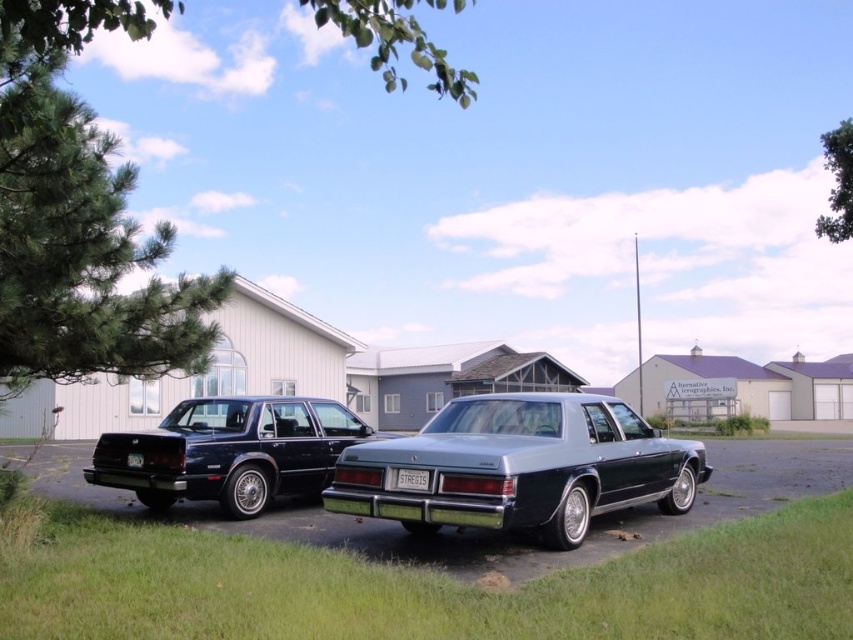
Question: Is metallic blue car at center to the left of glossy black sedan at left from the viewer's perspective?

Choices:
 (A) yes
 (B) no

Answer: (B)

Question: Does glossy black sedan at left have a greater width compared to white plastic license plate at center?

Choices:
 (A) yes
 (B) no

Answer: (A)

Question: Estimate the real-world distances between objects in this image. Which object is farther from the satin silver sedan at center?

Choices:
 (A) glossy black sedan at left
 (B) white plastic license plate at center

Answer: (A)

Question: Which point is farther to the camera?

Choices:
 (A) (416, 477)
 (B) (531, 548)
 (C) (344, 410)

Answer: (C)

Question: Which of the following is the closest to the observer?

Choices:
 (A) pos(412,472)
 (B) pos(515,445)
 (C) pos(689,525)

Answer: (A)

Question: Is satin silver sedan at center below metallic blue car at center?

Choices:
 (A) yes
 (B) no

Answer: (B)